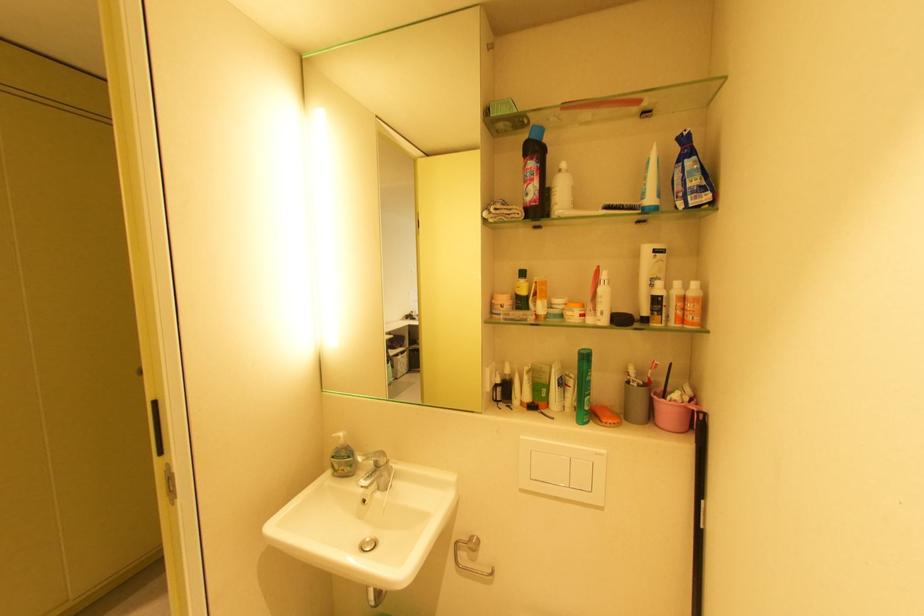
This screenshot has height=616, width=924. In order to click on soap dispenser pump in this screenshot , I will do `click(339, 438)`.